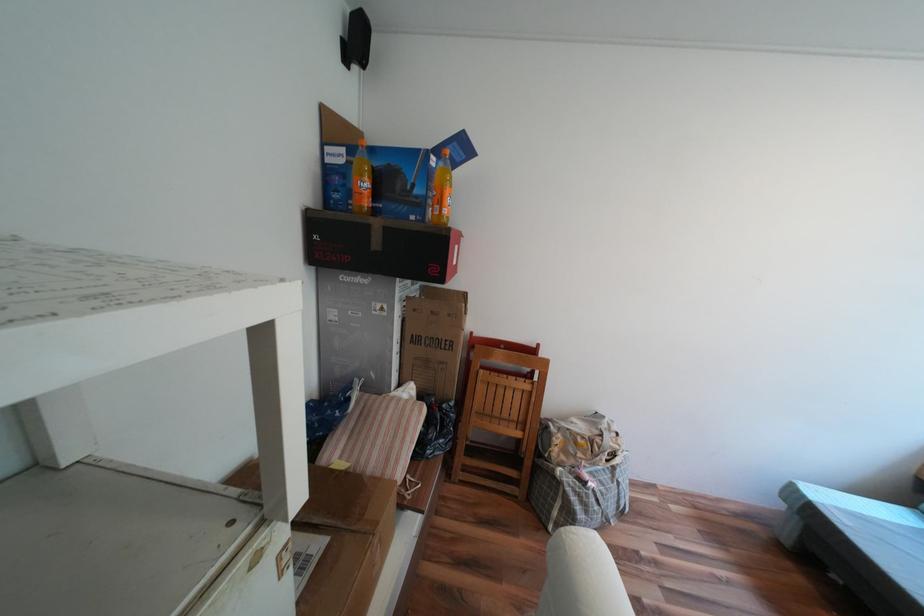
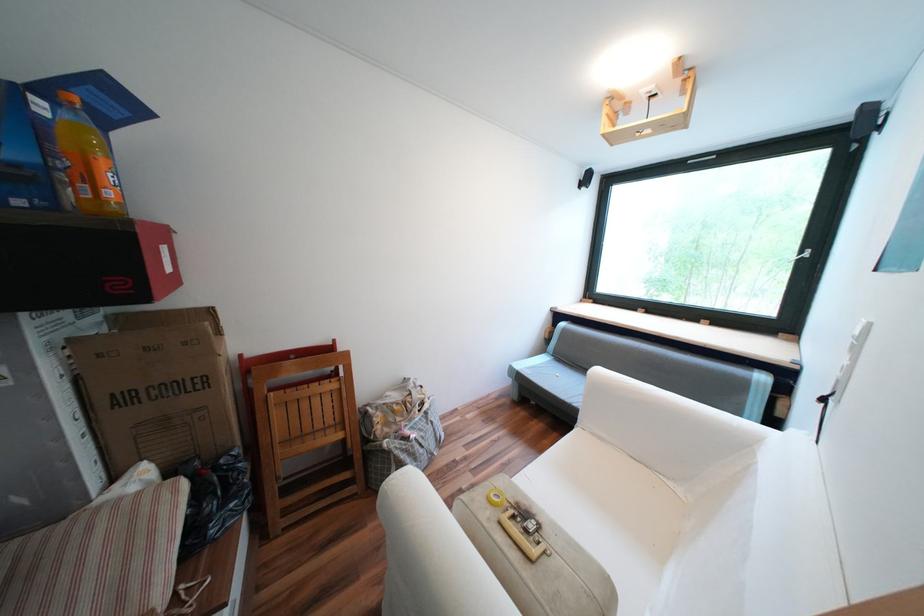
Where in the second image is the point corresponding to point (533, 570) from the first image?

(387, 548)